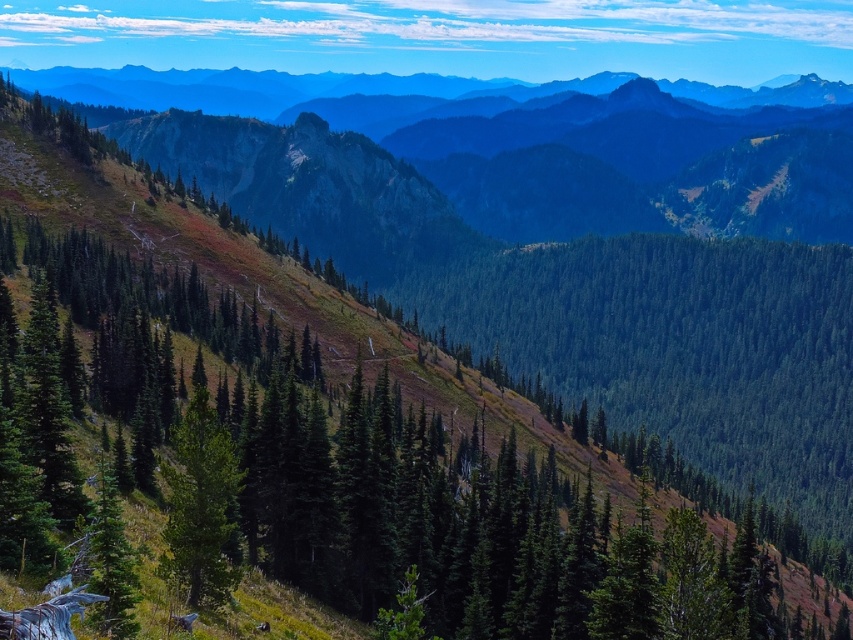
You are an environmental scientist analyzing the mountainous landscape. You observe the green textured trees at center and the green matte tree at center. Which of these two trees would cast a larger shadow during midday when the sun is directly overhead?

The green textured trees at center is larger in size than the green matte tree at center, so it would cast a larger shadow during midday when the sun is directly overhead.

You are standing at the base of the mountain and see the point marked at coordinates (323, 460). According to the image, what type of terrain feature is located at that point?

The point at (323, 460) is on green textured trees at center, which are part of the dense forested area in the middle ground of the mountainous landscape.